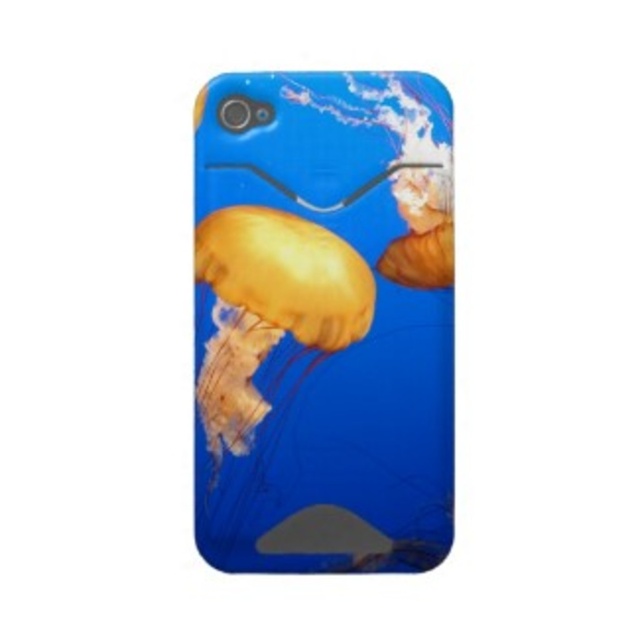
You are holding the smartphone case and want to place your finger on the point at position (371, 468) and then move it to the point at (273, 218). Will your finger pass over the area where the smaller jellyfish is located?

Point (371, 468) is in front of point (273, 218), so moving your finger from the first point to the second will pass over the area where the smaller jellyfish is located.

You are holding a smartphone case with an underwater theme. The case has a point at coordinates (323, 321). What object is located at this point?

The point (323, 321) corresponds to the translucent plastic jellyfish case at center.

You have a smartphone case with two jellyfish designs. The case itself is a translucent plastic jellyfish case at center, and there is a translucent yellow jellyfish at center. How far apart are these two jellyfish designs on the case?

The translucent plastic jellyfish case at center is 2.13 inches from the translucent yellow jellyfish at center.